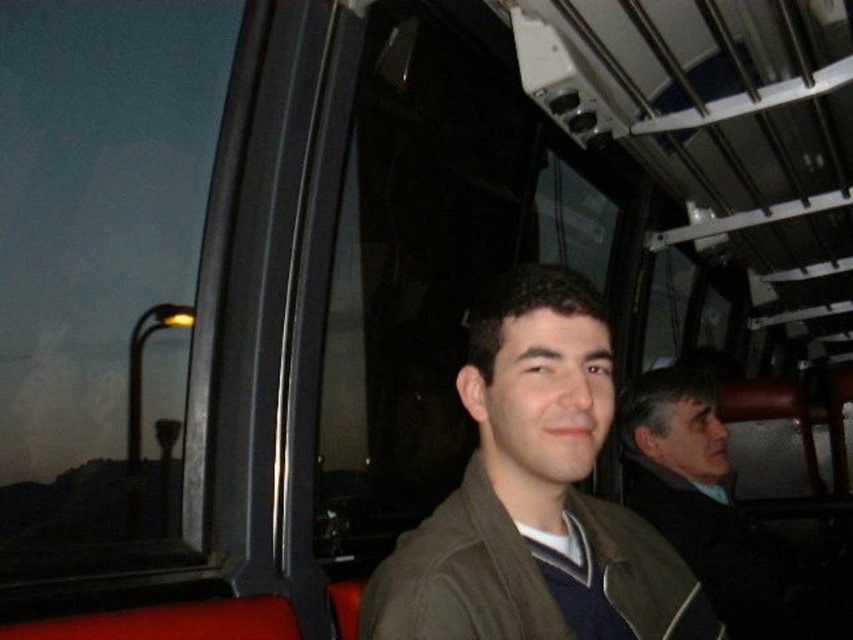
You are a passenger on a bus and you see two jackets in front of you. The matte brown jacket at center and the dark brown leather jacket at right. Which jacket is smaller in size?

The matte brown jacket at center is smaller in size compared to the dark brown leather jacket at right.

You are a passenger on a bus and you see a matte brown jacket at center and a dark brown leather jacket at right. Which jacket is closer to the left side of the bus?

The matte brown jacket at center is closer to the left side of the bus because it is positioned on the left side of the dark brown leather jacket at right.

From the picture: Where is the matte brown jacket at center located in the image?

The matte brown jacket at center is located at point (535, 496) in the image.